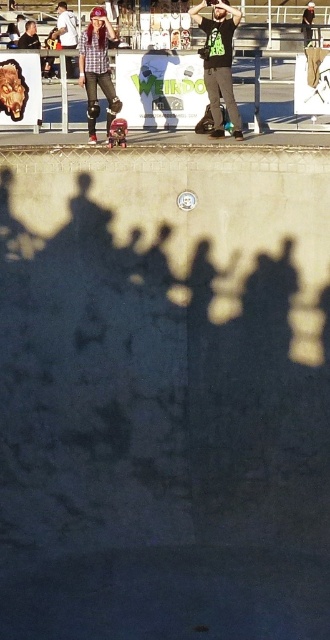
Can you confirm if green matte shirt at upper center is taller than metallic pink skateboard at center?

Correct, green matte shirt at upper center is much taller as metallic pink skateboard at center.

From the picture: Who is more distant from viewer, [212,60] or [121,141]?

Positioned behind is point [121,141].

I want to click on green matte shirt at upper center, so click(x=219, y=61).

Between point (232, 32) and point (61, 1), which one is positioned in front?

Positioned in front is point (232, 32).

The width and height of the screenshot is (330, 640). What are the coordinates of `green matte shirt at upper center` in the screenshot? It's located at (219, 61).

Does point (237, 125) lie behind point (69, 45)?

No, (237, 125) is in front of (69, 45).

The image size is (330, 640). In order to click on green matte shirt at upper center in this screenshot , I will do `click(219, 61)`.

Is point (230, 6) positioned behind point (97, 61)?

That is False.

What do you see at coordinates (219, 61) in the screenshot? I see `green matte shirt at upper center` at bounding box center [219, 61].

Is point (224, 80) less distant than point (99, 4)?

Yes.

Where is `green matte shirt at upper center`? This screenshot has height=640, width=330. green matte shirt at upper center is located at coordinates (219, 61).